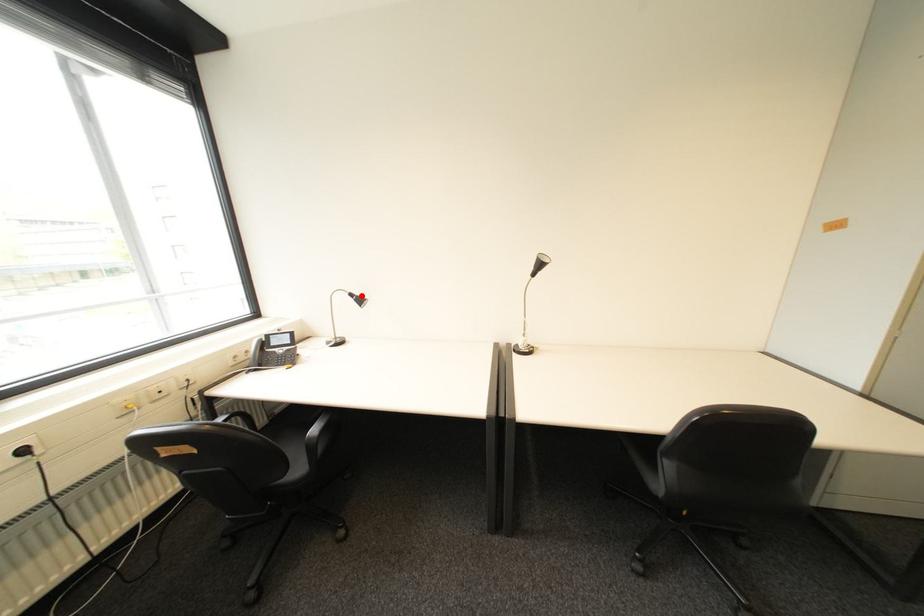
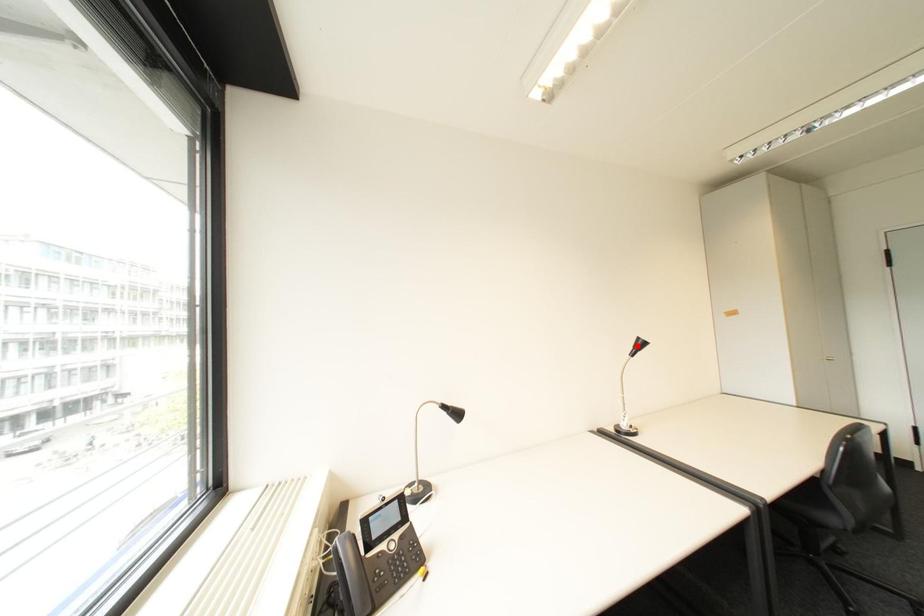
I am providing you with two images of the same scene from different viewpoints. A red point is marked on the first image and another point is marked on the second image. Is the red point in image1 aligned with the point shown in image2?

No